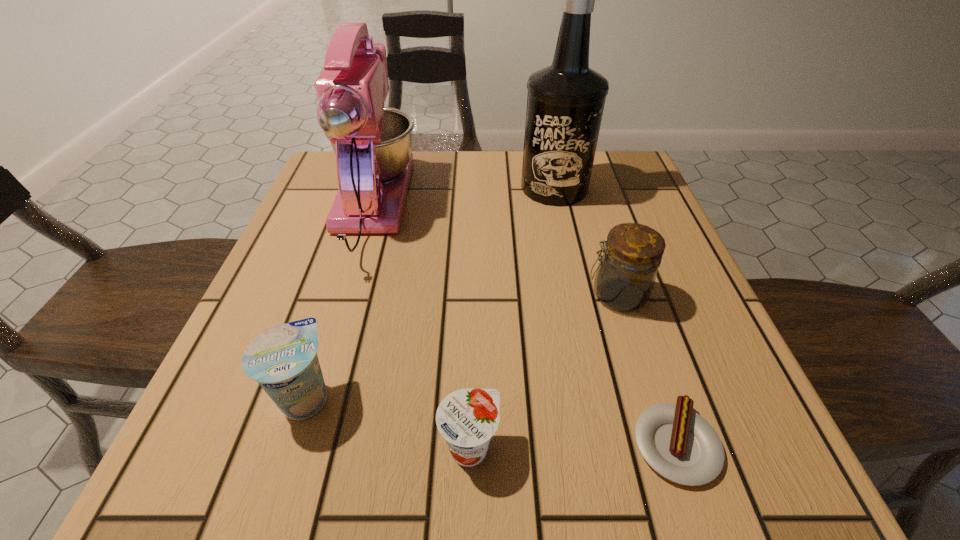
The height and width of the screenshot is (540, 960). Identify the location of liquor that is at the right edge. (565, 102).

Identify the location of jar that is at the right edge. The height and width of the screenshot is (540, 960). [625, 277].

The height and width of the screenshot is (540, 960). I want to click on sausage that is positioned at the right edge, so click(679, 444).

Locate an element on the screen. The width and height of the screenshot is (960, 540). object that is at the far left corner is located at coordinates (372, 143).

Where is `object that is positioned at the near left corner`? The height and width of the screenshot is (540, 960). object that is positioned at the near left corner is located at coordinates (283, 359).

Find the location of a particular element. This screenshot has width=960, height=540. object that is at the far right corner is located at coordinates (565, 102).

You are a GUI agent. You are given a task and a screenshot of the screen. Output one action in this format:
    pyautogui.click(x=<x>, y=<y>)
    Task: Click on the object that is at the near right corner
    
    Given the screenshot: What is the action you would take?
    tap(679, 444)

Find the location of a particular element. free space at the far edge of the desktop is located at coordinates (439, 191).

In the image, there is a desktop. At what (x,y) coordinates should I click in order to perform the action: click on vacant space at the left edge. Please return your answer as a coordinate pair (x, y). The width and height of the screenshot is (960, 540). Looking at the image, I should click on (330, 260).

Identify the location of free region at the right edge of the desktop. (662, 292).